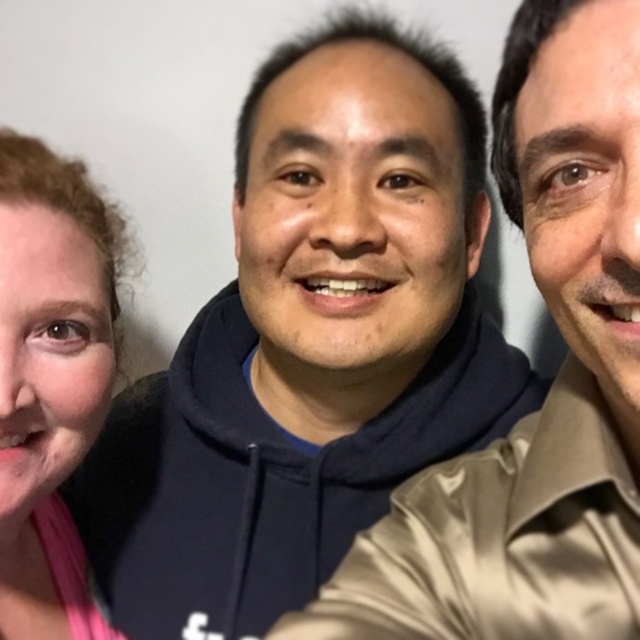
You are a photographer adjusting the camera focus. The camera has a depth of field that can only sharply focus on objects within a 30 centimeter range. Given the distance between the dark blue hoodie at center and the pink fabric at left, will both objects be in focus simultaneously?

The dark blue hoodie at center is 33.42 centimeters away from the pink fabric at left. Since the distance exceeds the camera lens depth of field range of 30 centimeters, both objects cannot be in focus at the same time.

You are trying to decide which part of the clothing items in the image is taller. You see the dark blue hoodie at center and the pink fabric at left. Which one is taller?

The pink fabric at left is taller than the dark blue hoodie at center.